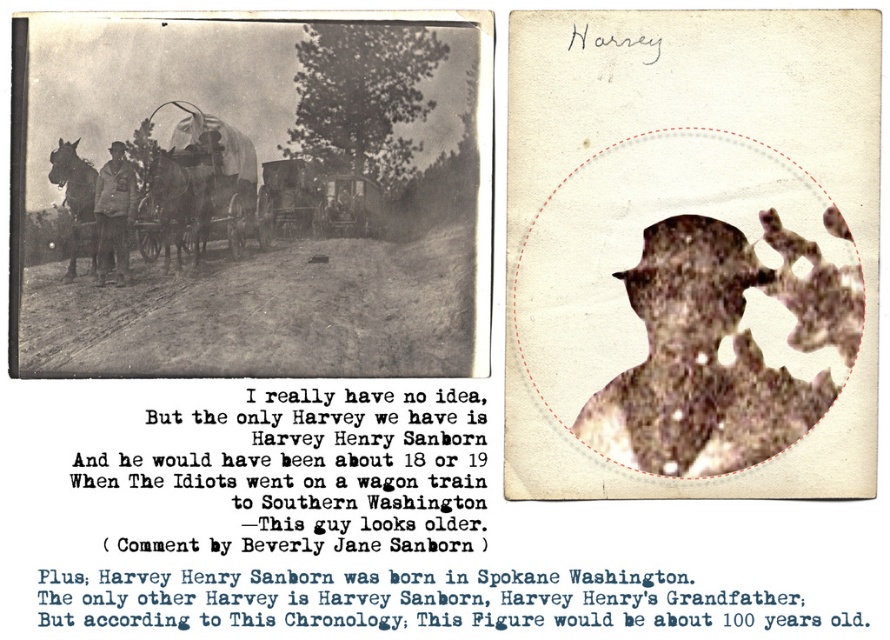
Question: In this image, where is brown paper silhouette at center located relative to dark brown leather horse at left?

Choices:
 (A) below
 (B) above

Answer: (A)

Question: Estimate the real-world distances between objects in this image. Which object is farther from the brown paper silhouette at center?

Choices:
 (A) white canvas wagon at center
 (B) brown leather horse at center
 (C) matte brown leather jacket at center

Answer: (C)

Question: Is brown paper silhouette at center above brown leather horse at center?

Choices:
 (A) yes
 (B) no

Answer: (B)

Question: Estimate the real-world distances between objects in this image. Which object is farther from the matte brown leather jacket at center?

Choices:
 (A) dark brown leather horse at left
 (B) brown paper silhouette at center
 (C) brown leather horse at center
 (D) white canvas wagon at center

Answer: (B)

Question: Observing the image, what is the correct spatial positioning of brown paper silhouette at center in reference to matte brown leather jacket at center?

Choices:
 (A) below
 (B) above

Answer: (A)

Question: Estimate the real-world distances between objects in this image. Which object is closer to the white canvas wagon at center?

Choices:
 (A) dark brown leather horse at left
 (B) brown leather horse at center
 (C) matte brown leather jacket at center
 (D) brown paper silhouette at center

Answer: (B)